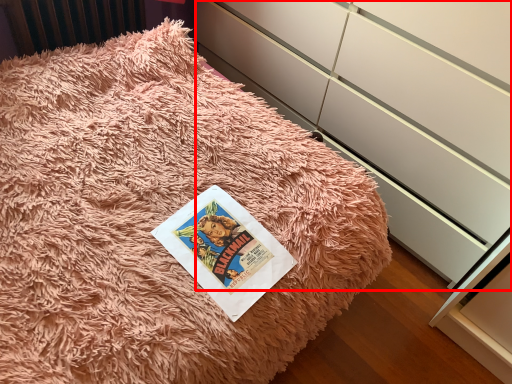
Question: Where is cabinetry (annotated by the red box) located in relation to paperback book in the image?

Choices:
 (A) left
 (B) right

Answer: (B)